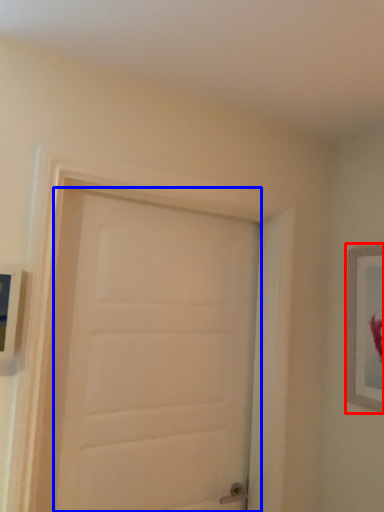
Question: Among these objects, which one is nearest to the camera, picture frame (highlighted by a red box) or door (highlighted by a blue box)?

Choices:
 (A) picture frame
 (B) door

Answer: (B)